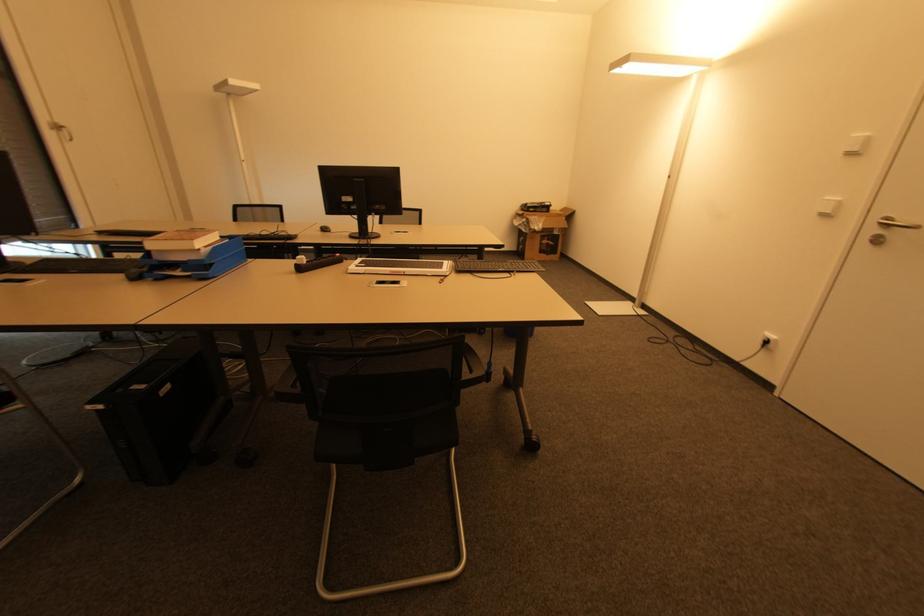
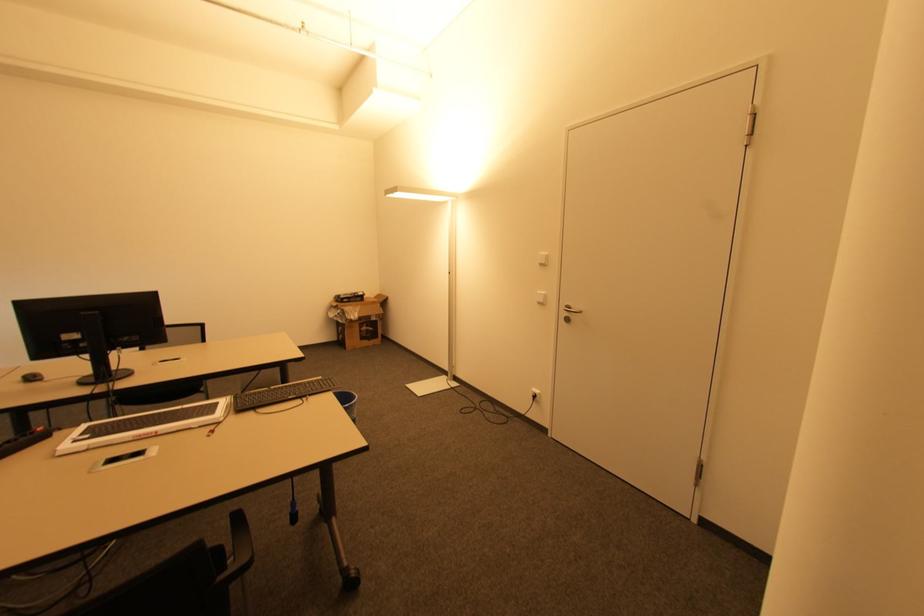
Find the pixel in the second image that matches (x=321, y=229) in the first image.

(21, 379)